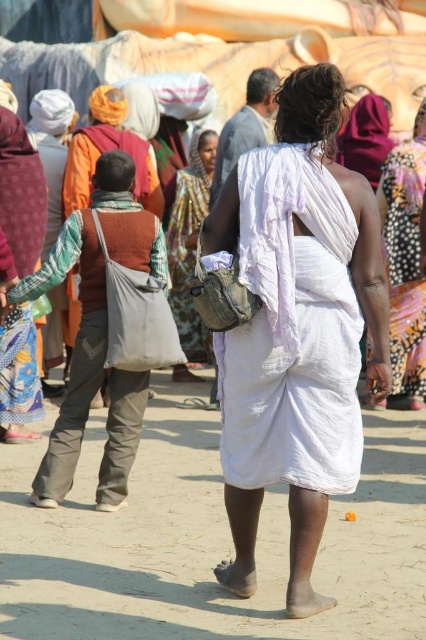
You are a photographer trying to capture the scene. You notice the white cotton dhoti at center and the white cloth at center. Which one is closer to the camera?

The white cotton dhoti at center is in front of the white cloth at center, so it is closer to the camera.

You are a photographer trying to capture the scene. Since you want to focus on the dirt field at lower center and the white cotton saree at center, which one should you adjust your camera to focus on first considering their positions?

The dirt field at lower center is closer to the viewer than the white cotton saree at center, so you should adjust your camera to focus on the dirt field at lower center first.